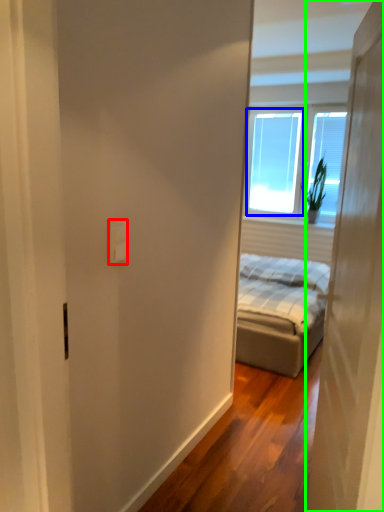
Question: Considering the real-world distances, which object is farthest from electric outlet (highlighted by a red box)? window screen (highlighted by a blue box) or door (highlighted by a green box)?

Choices:
 (A) window screen
 (B) door

Answer: (A)